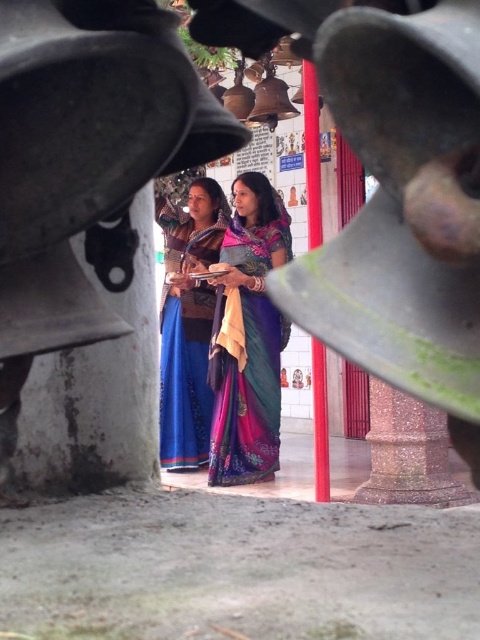
Question: Can you confirm if silky blue sari at center is thinner than blue silk saree at center?

Choices:
 (A) yes
 (B) no

Answer: (A)

Question: Which point is farther to the camera?

Choices:
 (A) silky blue sari at center
 (B) blue silk saree at center

Answer: (B)

Question: Is silky blue sari at center positioned behind blue silk saree at center?

Choices:
 (A) no
 (B) yes

Answer: (A)

Question: Which object is closer to the camera taking this photo?

Choices:
 (A) silky blue sari at center
 (B) blue silk saree at center

Answer: (A)

Question: Does silky blue sari at center appear under blue silk saree at center?

Choices:
 (A) no
 (B) yes

Answer: (B)

Question: Which point is farther to the camera?

Choices:
 (A) blue silk saree at center
 (B) silky blue sari at center

Answer: (A)